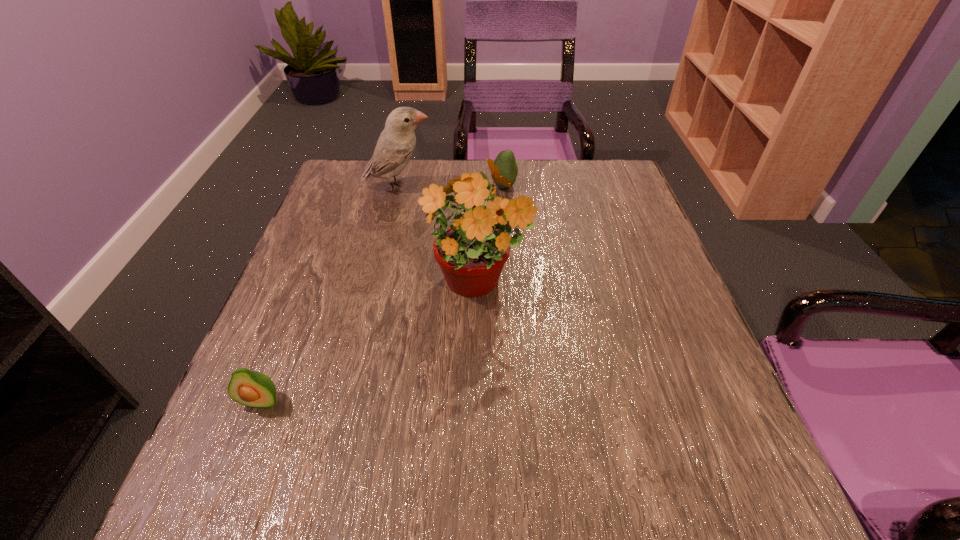
Where is `flowerpot`? The width and height of the screenshot is (960, 540). flowerpot is located at coordinates (471, 251).

Locate an element on the screen. the third farthest object is located at coordinates (471, 251).

Identify the location of bird. (396, 144).

Identify the location of the third shortest object. The height and width of the screenshot is (540, 960). (396, 144).

Image resolution: width=960 pixels, height=540 pixels. In order to click on the right avocado in this screenshot , I will do `click(505, 160)`.

This screenshot has height=540, width=960. I want to click on the nearer avocado, so click(x=250, y=388).

Locate an element on the screen. The image size is (960, 540). the nearest object is located at coordinates (250, 388).

Where is `free space located on the back of the second nearest object`? free space located on the back of the second nearest object is located at coordinates (477, 224).

The image size is (960, 540). Find the location of `vacant space situated at the face of the second object from left to right`. vacant space situated at the face of the second object from left to right is located at coordinates (516, 188).

Locate an element on the screen. This screenshot has height=540, width=960. vacant space located 0.110m on the right of the farther avocado is located at coordinates (558, 186).